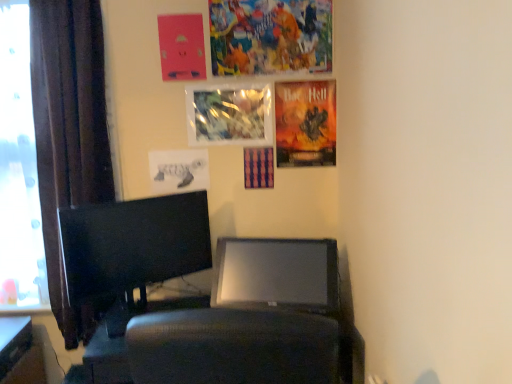
Question: Is the position of metallic reflective poster at upper center, which is counted as the 3th poster page, starting from the bottom, less distant than that of colorful collage at upper center, placed as the first poster page when sorted from top to bottom?

Choices:
 (A) no
 (B) yes

Answer: (A)

Question: From the image's perspective, is metallic reflective poster at upper center, which is counted as the 3th poster page, starting from the bottom, on colorful collage at upper center, which appears as the 5th poster page when ordered from the bottom?

Choices:
 (A) yes
 (B) no

Answer: (B)

Question: Is metallic reflective poster at upper center, which is counted as the 3th poster page, starting from the bottom, positioned with its back to colorful collage at upper center, placed as the first poster page when sorted from top to bottom?

Choices:
 (A) yes
 (B) no

Answer: (B)

Question: Considering the relative sizes of metallic reflective poster at upper center, which is counted as the 3th poster page, starting from the bottom, and colorful collage at upper center, which appears as the 5th poster page when ordered from the bottom, in the image provided, is metallic reflective poster at upper center, which is counted as the 3th poster page, starting from the bottom, bigger than colorful collage at upper center, which appears as the 5th poster page when ordered from the bottom,?

Choices:
 (A) no
 (B) yes

Answer: (A)

Question: Does metallic reflective poster at upper center, the 3th poster page positioned from the top, contain colorful collage at upper center, placed as the first poster page when sorted from top to bottom?

Choices:
 (A) yes
 (B) no

Answer: (B)

Question: From a real-world perspective, is metallic reflective poster at upper center, which is counted as the 3th poster page, starting from the bottom, physically located above or below orange matte poster at upper right, acting as the 4th poster page starting from the top?

Choices:
 (A) below
 (B) above

Answer: (B)

Question: Is metallic reflective poster at upper center, the 3th poster page positioned from the top, spatially inside orange matte poster at upper right, acting as the second poster page starting from the bottom, or outside of it?

Choices:
 (A) outside
 (B) inside

Answer: (A)

Question: From the image's perspective, relative to orange matte poster at upper right, acting as the second poster page starting from the bottom, is metallic reflective poster at upper center, the 3th poster page positioned from the top, above or below?

Choices:
 (A) below
 (B) above

Answer: (B)

Question: Relative to orange matte poster at upper right, acting as the second poster page starting from the bottom, is metallic reflective poster at upper center, the 3th poster page positioned from the top, in front or behind?

Choices:
 (A) front
 (B) behind

Answer: (A)

Question: From the image's perspective, is transparent glass window at left positioned above or below black glossy monitor at left?

Choices:
 (A) above
 (B) below

Answer: (A)

Question: Considering their positions, is transparent glass window at left located in front of or behind black glossy monitor at left?

Choices:
 (A) behind
 (B) front

Answer: (A)

Question: From a real-world perspective, is transparent glass window at left positioned above or below black glossy monitor at left?

Choices:
 (A) below
 (B) above

Answer: (B)

Question: Is transparent glass window at left inside or outside of black glossy monitor at left?

Choices:
 (A) outside
 (B) inside

Answer: (A)

Question: In terms of height, does dark brown fabric curtain at left look taller or shorter compared to black glossy monitor at left?

Choices:
 (A) short
 (B) tall

Answer: (B)

Question: From the image's perspective, relative to black glossy monitor at left, is dark brown fabric curtain at left above or below?

Choices:
 (A) below
 (B) above

Answer: (B)